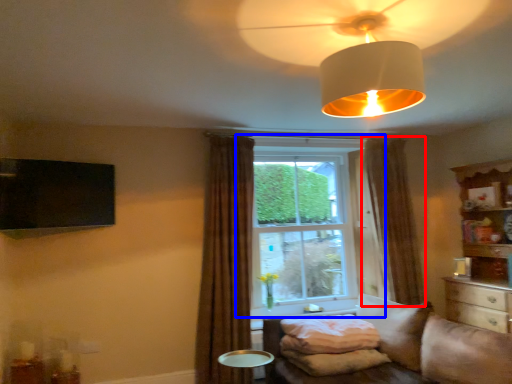
Question: Which of the following is the farthest to the observer, curtain (highlighted by a red box) or window (highlighted by a blue box)?

Choices:
 (A) curtain
 (B) window

Answer: (B)